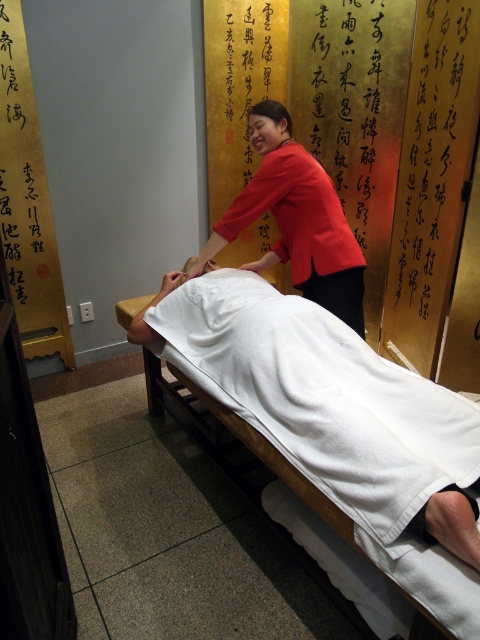
What do you see at coordinates (330, 417) in the screenshot? I see `white towel-covered bed at center` at bounding box center [330, 417].

Which is more to the left, white towel-covered bed at center or red smooth blouse at center?

From the viewer's perspective, red smooth blouse at center appears more on the left side.

Does point (414, 515) lie in front of point (257, 202)?

Yes, it is in front of point (257, 202).

Image resolution: width=480 pixels, height=640 pixels. I want to click on white towel-covered bed at center, so click(330, 417).